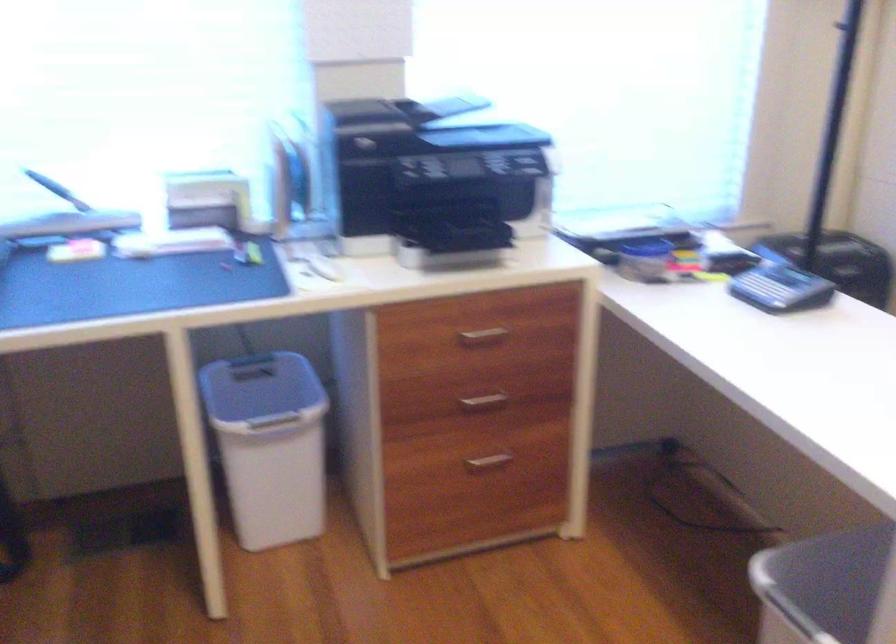
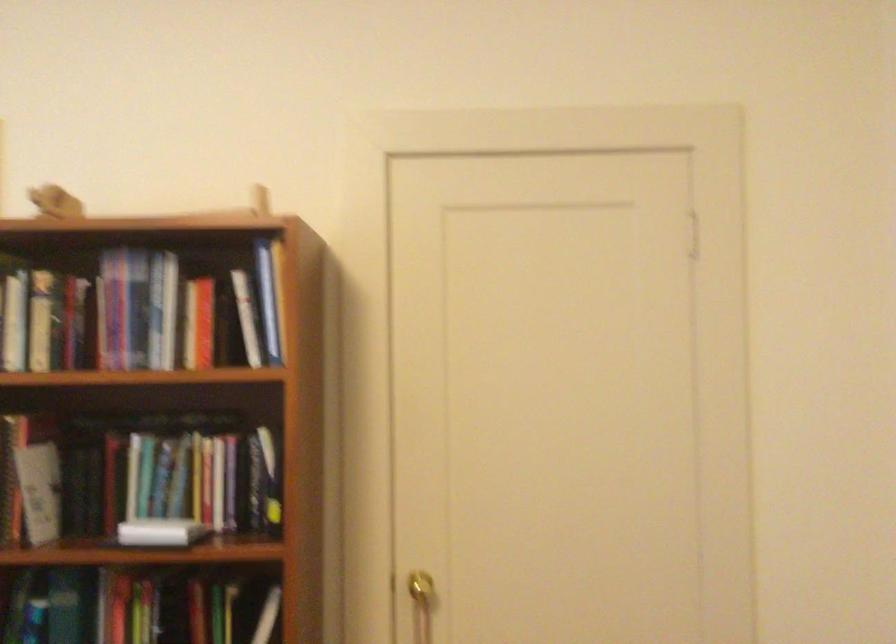
Question: The first image is from the beginning of the video and the second image is from the end. How did the camera likely rotate when shooting the video?

Choices:
 (A) Left
 (B) Right
 (C) Up
 (D) Down

Answer: (B)